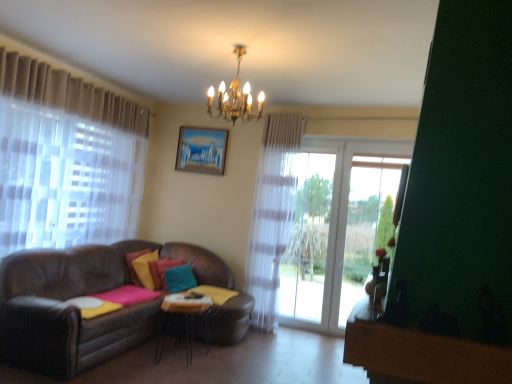
This screenshot has width=512, height=384. What do you see at coordinates (202, 150) in the screenshot?
I see `matte wooden picture frame at upper center` at bounding box center [202, 150].

Where is `matte wooden picture frame at upper center`? This screenshot has height=384, width=512. matte wooden picture frame at upper center is located at coordinates (202, 150).

This screenshot has width=512, height=384. Describe the element at coordinates (178, 278) in the screenshot. I see `teal matte pillow at center, which is the 1th pillow from right to left` at that location.

How much space does teal matte pillow at center, arranged as the third pillow when viewed from the left, occupy vertically?

teal matte pillow at center, arranged as the third pillow when viewed from the left, is 15.59 inches tall.

Describe the element at coordinates (183, 319) in the screenshot. This screenshot has width=512, height=384. I see `metallic silver table at center` at that location.

Identify the location of matte wooden picture frame at upper center. The image size is (512, 384). (202, 150).

From their relative heights in the image, would you say gold metallic chandelier at upper center is taller or shorter than teal matte pillow at center, arranged as the third pillow when viewed from the left?

gold metallic chandelier at upper center is taller than teal matte pillow at center, arranged as the third pillow when viewed from the left.

From the image's perspective, which is below, gold metallic chandelier at upper center or teal matte pillow at center, arranged as the third pillow when viewed from the left?

teal matte pillow at center, arranged as the third pillow when viewed from the left, is shown below in the image.

Considering the sizes of gold metallic chandelier at upper center and teal matte pillow at center, which is the 1th pillow from right to left, in the image, is gold metallic chandelier at upper center wider or thinner than teal matte pillow at center, which is the 1th pillow from right to left,?

Considering their sizes, gold metallic chandelier at upper center looks broader than teal matte pillow at center, which is the 1th pillow from right to left.

This screenshot has width=512, height=384. Find the location of `picture frame above the metallic silver table at center (from a real-world perspective)`. picture frame above the metallic silver table at center (from a real-world perspective) is located at coordinates (202, 150).

Considering the sizes of objects metallic silver table at center and matte wooden picture frame at upper center in the image provided, who is wider, metallic silver table at center or matte wooden picture frame at upper center?

With larger width is metallic silver table at center.

Between point (162, 345) and point (184, 168), which one is positioned behind?

The point (184, 168) is farther.

Is metallic silver table at center taller or shorter than matte wooden picture frame at upper center?

Clearly, metallic silver table at center is shorter compared to matte wooden picture frame at upper center.

From the image's perspective, which one is positioned higher, matte wooden picture frame at upper center or velvet yellow pillow at center, which is the 3th pillow in right-to-left order?

matte wooden picture frame at upper center, from the image's perspective.

Can you confirm if matte wooden picture frame at upper center is positioned to the left of velvet yellow pillow at center, the 1th pillow positioned from the left?

No, matte wooden picture frame at upper center is not to the left of velvet yellow pillow at center, the 1th pillow positioned from the left.

Is matte wooden picture frame at upper center facing towards velvet yellow pillow at center, the 1th pillow positioned from the left?

No, matte wooden picture frame at upper center is not oriented towards velvet yellow pillow at center, the 1th pillow positioned from the left.

In terms of height, does teal matte pillow at center, placed as the second pillow when sorted from left to right, look taller or shorter compared to metallic silver table at center?

Considering their sizes, teal matte pillow at center, placed as the second pillow when sorted from left to right, has less height than metallic silver table at center.

This screenshot has width=512, height=384. What are the coordinates of `table that is in front of the teal matte pillow at center, placed as the second pillow when sorted from left to right` in the screenshot? It's located at (183, 319).

Can you confirm if teal matte pillow at center, placed as the second pillow when sorted from left to right, is positioned to the left of metallic silver table at center?

Yes.

Is teal matte pillow at center, placed as the second pillow when sorted from left to right, not near metallic silver table at center?

No, there isn't a large distance between teal matte pillow at center, placed as the second pillow when sorted from left to right, and metallic silver table at center.

Is velvet yellow pillow at center, the 1th pillow positioned from the left, bigger than teal matte pillow at center, the second pillow positioned from the right?

Indeed, velvet yellow pillow at center, the 1th pillow positioned from the left, has a larger size compared to teal matte pillow at center, the second pillow positioned from the right.

Considering the relative positions of velvet yellow pillow at center, which is the 3th pillow in right-to-left order, and teal matte pillow at center, placed as the second pillow when sorted from left to right, in the image provided, is velvet yellow pillow at center, which is the 3th pillow in right-to-left order, to the left of teal matte pillow at center, placed as the second pillow when sorted from left to right, from the viewer's perspective?

Indeed, velvet yellow pillow at center, which is the 3th pillow in right-to-left order, is positioned on the left side of teal matte pillow at center, placed as the second pillow when sorted from left to right.

Is velvet yellow pillow at center, which is the 3th pillow in right-to-left order, facing towards teal matte pillow at center, placed as the second pillow when sorted from left to right?

Yes, velvet yellow pillow at center, which is the 3th pillow in right-to-left order, is turned towards teal matte pillow at center, placed as the second pillow when sorted from left to right.

Considering the positions of objects velvet yellow pillow at center, the 1th pillow positioned from the left, and teal matte pillow at center, placed as the second pillow when sorted from left to right, in the image provided, who is in front, velvet yellow pillow at center, the 1th pillow positioned from the left, or teal matte pillow at center, placed as the second pillow when sorted from left to right,?

velvet yellow pillow at center, the 1th pillow positioned from the left, is closer to the camera.

Based on their positions, is teal matte pillow at center, arranged as the third pillow when viewed from the left, located to the left or right of matte wooden picture frame at upper center?

From the image, it's evident that teal matte pillow at center, arranged as the third pillow when viewed from the left, is to the left of matte wooden picture frame at upper center.

Measure the distance from teal matte pillow at center, arranged as the third pillow when viewed from the left, to matte wooden picture frame at upper center.

teal matte pillow at center, arranged as the third pillow when viewed from the left, is 5.08 feet from matte wooden picture frame at upper center.

From the image's perspective, would you say teal matte pillow at center, which is the 1th pillow from right to left, is positioned over matte wooden picture frame at upper center?

No, from the image's perspective, teal matte pillow at center, which is the 1th pillow from right to left, is not over matte wooden picture frame at upper center.

Is point (190, 280) closer to viewer compared to point (193, 163)?

Yes, point (190, 280) is closer to viewer.

Locate an element on the screen. The height and width of the screenshot is (384, 512). pillow located below the teal matte pillow at center, the second pillow positioned from the right (from the image's perspective) is located at coordinates tap(178, 278).

From the picture: Does teal matte pillow at center, placed as the second pillow when sorted from left to right, have a smaller size compared to teal matte pillow at center, arranged as the third pillow when viewed from the left?

Indeed, teal matte pillow at center, placed as the second pillow when sorted from left to right, has a smaller size compared to teal matte pillow at center, arranged as the third pillow when viewed from the left.

Does teal matte pillow at center, the second pillow positioned from the right, have a lesser height compared to teal matte pillow at center, which is the 1th pillow from right to left?

Incorrect, the height of teal matte pillow at center, the second pillow positioned from the right, does not fall short of that of teal matte pillow at center, which is the 1th pillow from right to left.

Is point (158, 267) closer or farther from the camera than point (180, 272)?

Clearly, point (158, 267) is more distant from the camera than point (180, 272).

From the image's perspective, starting from the gold metallic chandelier at upper center, which pillow is the 3rd one below? Please provide its 2D coordinates.

[(178, 278)]

Locate an element on the screen. The image size is (512, 384). picture frame on the left side of metallic silver table at center is located at coordinates (202, 150).

Which object lies further to the anchor point teal matte pillow at center, the second pillow positioned from the right, velvet yellow pillow at center, the 1th pillow positioned from the left, or gold metallic chandelier at upper center?

gold metallic chandelier at upper center lies further to teal matte pillow at center, the second pillow positioned from the right, than the other object.

Which object lies further to the anchor point teal matte pillow at center, which is the 1th pillow from right to left, gold metallic chandelier at upper center or metallic silver table at center?

gold metallic chandelier at upper center is positioned further to the anchor teal matte pillow at center, which is the 1th pillow from right to left.

Looking at the image, which one is located further to teal matte pillow at center, which is the 1th pillow from right to left, velvet yellow pillow at center, the 1th pillow positioned from the left, or gold metallic chandelier at upper center?

gold metallic chandelier at upper center lies further to teal matte pillow at center, which is the 1th pillow from right to left, than the other object.

Considering their positions, is metallic silver table at center positioned closer to teal matte pillow at center, which is the 1th pillow from right to left, than matte wooden picture frame at upper center?

metallic silver table at center.

When comparing their distances from matte wooden picture frame at upper center, does velvet yellow pillow at center, the 1th pillow positioned from the left, or metallic silver table at center seem closer?

velvet yellow pillow at center, the 1th pillow positioned from the left, is positioned closer to the anchor matte wooden picture frame at upper center.

When comparing their distances from teal matte pillow at center, arranged as the third pillow when viewed from the left, does velvet yellow pillow at center, the 1th pillow positioned from the left, or matte wooden picture frame at upper center seem further?

matte wooden picture frame at upper center is positioned further to the anchor teal matte pillow at center, arranged as the third pillow when viewed from the left.

Estimate the real-world distances between objects in this image. Which object is closer to teal matte pillow at center, placed as the second pillow when sorted from left to right, velvet yellow pillow at center, the 1th pillow positioned from the left, or matte wooden picture frame at upper center?

Based on the image, velvet yellow pillow at center, the 1th pillow positioned from the left, appears to be nearer to teal matte pillow at center, placed as the second pillow when sorted from left to right.

Estimate the real-world distances between objects in this image. Which object is closer to gold metallic chandelier at upper center, matte wooden picture frame at upper center or teal matte pillow at center, the second pillow positioned from the right?

matte wooden picture frame at upper center lies closer to gold metallic chandelier at upper center than the other object.

Find the location of a particular element. This screenshot has width=512, height=384. pillow located between metallic silver table at center and velvet yellow pillow at center, the 1th pillow positioned from the left, in the depth direction is located at coordinates (178, 278).

Find the location of a particular element. pillow between velvet yellow pillow at center, which is the 3th pillow in right-to-left order, and teal matte pillow at center, arranged as the third pillow when viewed from the left, in the horizontal direction is located at coordinates point(162,270).

Locate an element on the screen. The image size is (512, 384). table between gold metallic chandelier at upper center and matte wooden picture frame at upper center along the z-axis is located at coordinates (183, 319).

Find the location of a particular element. pillow between gold metallic chandelier at upper center and teal matte pillow at center, the second pillow positioned from the right, in the vertical direction is located at coordinates (133, 267).